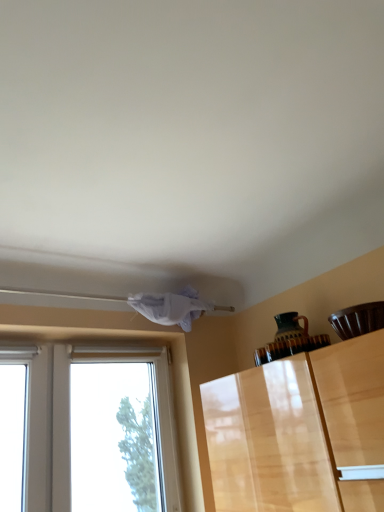
Find the location of `glossy wood cabinet at lower right`. glossy wood cabinet at lower right is located at coordinates (299, 431).

Describe the element at coordinates (299, 431) in the screenshot. The image size is (384, 512). I see `glossy wood cabinet at lower right` at that location.

What is the approximate width of glossy wood cabinet at lower right?

It is 33.43 centimeters.

Where is `glossy wood cabinet at lower right`? The width and height of the screenshot is (384, 512). glossy wood cabinet at lower right is located at coordinates (299, 431).